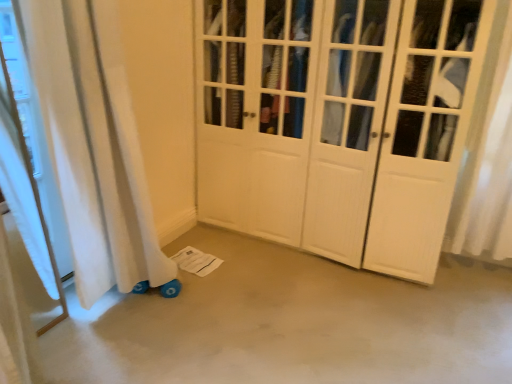
Question: Is smooth concrete floor at lower center in front of or behind white wood wardrobe at center in the image?

Choices:
 (A) front
 (B) behind

Answer: (A)

Question: Is point (161, 345) positioned closer to the camera than point (417, 145)?

Choices:
 (A) closer
 (B) farther

Answer: (A)

Question: From the image's perspective, is smooth concrete floor at lower center above or below white wood wardrobe at center?

Choices:
 (A) above
 (B) below

Answer: (B)

Question: Based on their sizes in the image, would you say white wood wardrobe at center is bigger or smaller than smooth concrete floor at lower center?

Choices:
 (A) small
 (B) big

Answer: (B)

Question: Is white wood wardrobe at center situated inside smooth concrete floor at lower center or outside?

Choices:
 (A) outside
 (B) inside

Answer: (A)

Question: Visually, is white wood wardrobe at center positioned to the left or to the right of smooth concrete floor at lower center?

Choices:
 (A) right
 (B) left

Answer: (A)

Question: Is white wood wardrobe at center in front of or behind smooth concrete floor at lower center in the image?

Choices:
 (A) behind
 (B) front

Answer: (A)